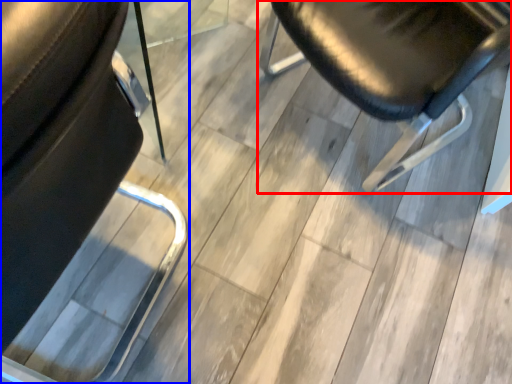
Question: Which of the following is the closest to the observer, chair (highlighted by a red box) or chair (highlighted by a blue box)?

Choices:
 (A) chair
 (B) chair

Answer: (B)